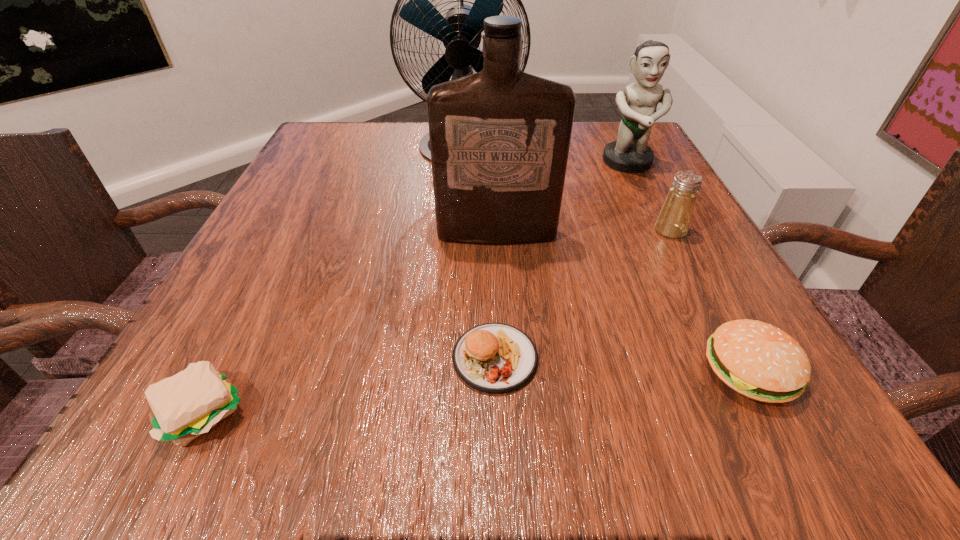
The height and width of the screenshot is (540, 960). Find the location of `fan`. fan is located at coordinates (460, 31).

What are the coordinates of `liquor` in the screenshot? It's located at (499, 139).

Image resolution: width=960 pixels, height=540 pixels. Find the location of `figurine`. figurine is located at coordinates (630, 153).

Locate an element on the screen. The height and width of the screenshot is (540, 960). the fourth shortest object is located at coordinates (674, 218).

The width and height of the screenshot is (960, 540). What are the coordinates of `the rightmost patty` in the screenshot? It's located at (760, 361).

The width and height of the screenshot is (960, 540). Find the location of `the second patty from left to right`. the second patty from left to right is located at coordinates (495, 358).

Identify the location of the leftmost patty. This screenshot has width=960, height=540. click(184, 406).

The width and height of the screenshot is (960, 540). I want to click on blank space located 0.170m on the front-facing side of the fan, so click(x=460, y=227).

Locate an element on the screen. This screenshot has width=960, height=540. free space located on the label side of the liquor is located at coordinates (499, 283).

Where is `vacant position located 0.300m on the front-facing side of the figurine`? This screenshot has height=540, width=960. vacant position located 0.300m on the front-facing side of the figurine is located at coordinates (684, 278).